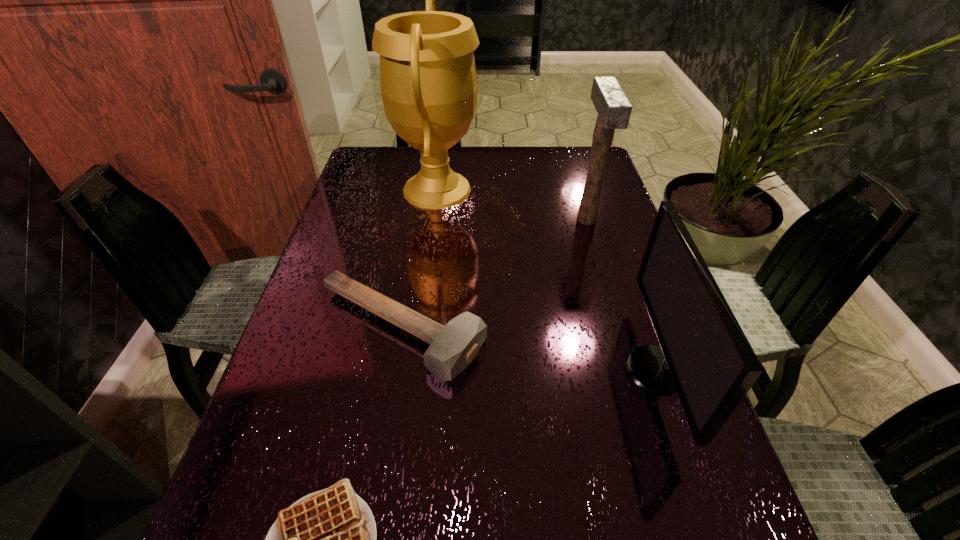
In order to click on free space that satisfies the following two spatial constraints: 1. on the engravings side of the tallest object; 2. on the right side of the right mallet in this screenshot , I will do `click(433, 219)`.

Find the location of a particular element. vacant region that satisfies the following two spatial constraints: 1. on the engravings side of the tallest object; 2. on the back side of the right mallet is located at coordinates (433, 219).

At what (x,y) coordinates should I click in order to perform the action: click on free space that satisfies the following two spatial constraints: 1. on the engravings side of the second tallest object; 2. on the left side of the tallest object. Please return your answer as a coordinate pair (x, y). The height and width of the screenshot is (540, 960). Looking at the image, I should click on (433, 219).